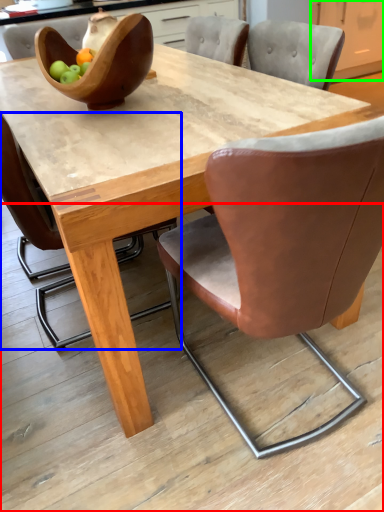
Question: Which object is the closest to the concrete (highlighted by a red box)? Choose among these: chair (highlighted by a blue box) or cabinetry (highlighted by a green box).

Choices:
 (A) chair
 (B) cabinetry

Answer: (A)